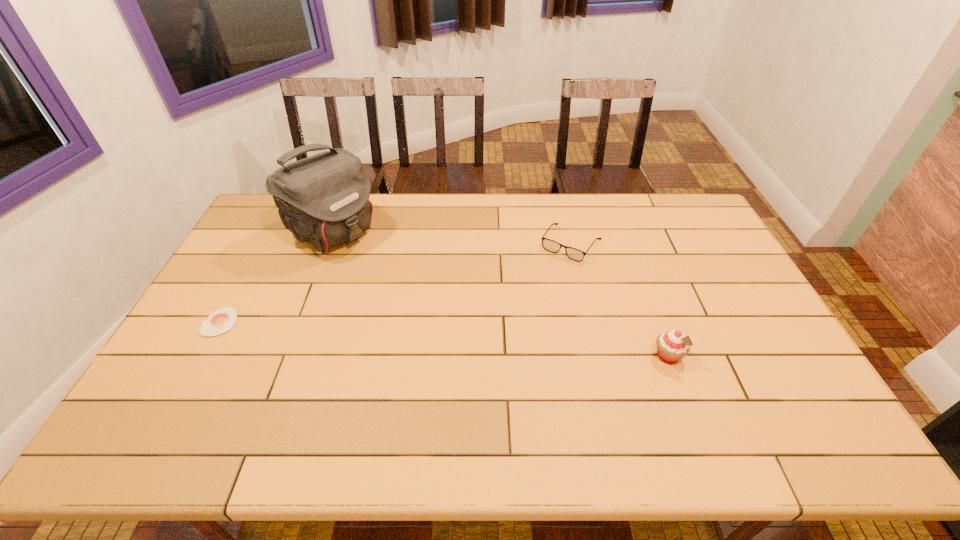
Where is `object situated at the far left corner`? This screenshot has width=960, height=540. object situated at the far left corner is located at coordinates [x=323, y=199].

The width and height of the screenshot is (960, 540). I want to click on free space at the far edge of the desktop, so click(x=580, y=206).

At what (x,y) coordinates should I click in order to perform the action: click on vacant area at the right edge of the desktop. Please return your answer as a coordinate pair (x, y). Looking at the image, I should click on (769, 352).

The height and width of the screenshot is (540, 960). Identify the location of vacant area at the near left corner of the desktop. (165, 388).

Locate an element on the screen. The height and width of the screenshot is (540, 960). vacant space that is in between the shortest object and the second shortest object is located at coordinates (396, 283).

The width and height of the screenshot is (960, 540). Find the location of `unoccupied position between the second object from left to right and the cupcake`. unoccupied position between the second object from left to right and the cupcake is located at coordinates (501, 294).

The image size is (960, 540). Identify the location of free space between the nearest object and the leftmost object. pos(444,339).

The height and width of the screenshot is (540, 960). In order to click on free space between the spectacles and the third object from right to left in this screenshot , I will do `click(452, 238)`.

The width and height of the screenshot is (960, 540). In order to click on vacant space that is in between the shoulder bag and the spectacles in this screenshot , I will do `click(452, 238)`.

Where is `free space that is in between the cupcake and the shortest object`? The height and width of the screenshot is (540, 960). free space that is in between the cupcake and the shortest object is located at coordinates (444, 339).